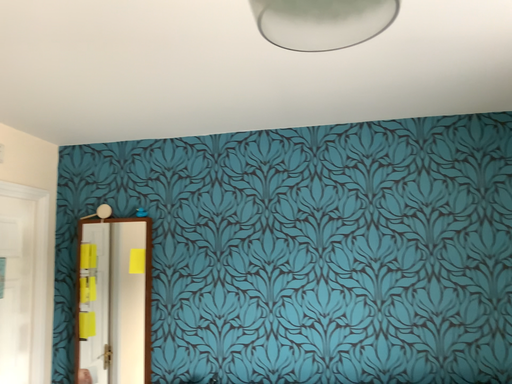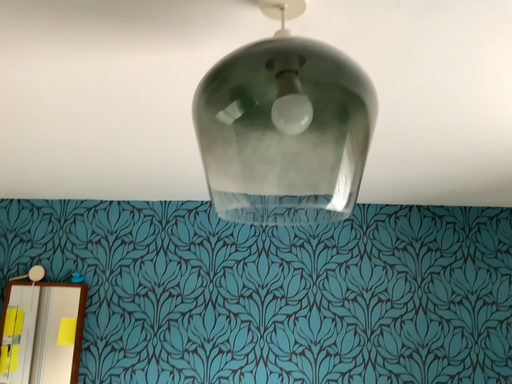
Question: Which way did the camera rotate in the video?

Choices:
 (A) rotated right
 (B) rotated left

Answer: (A)